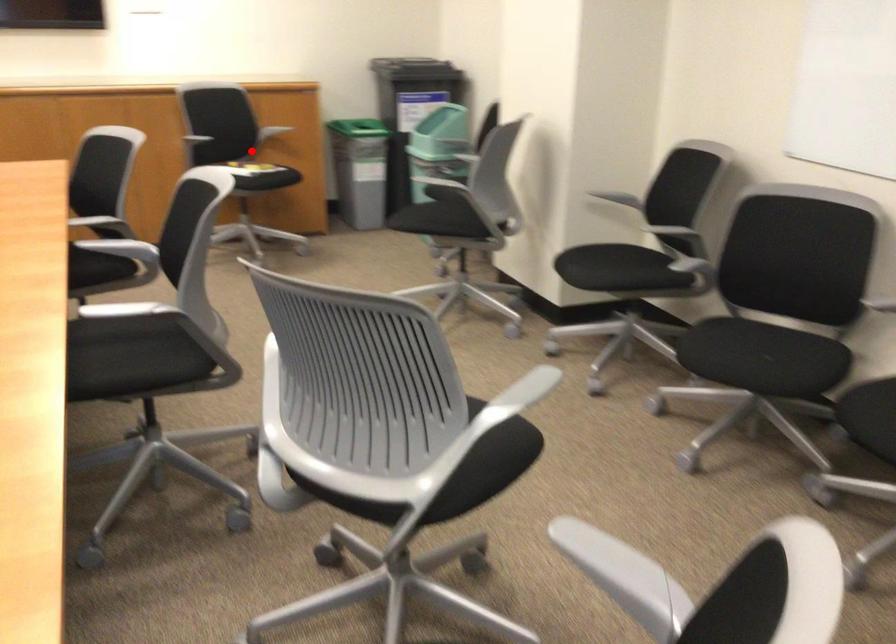
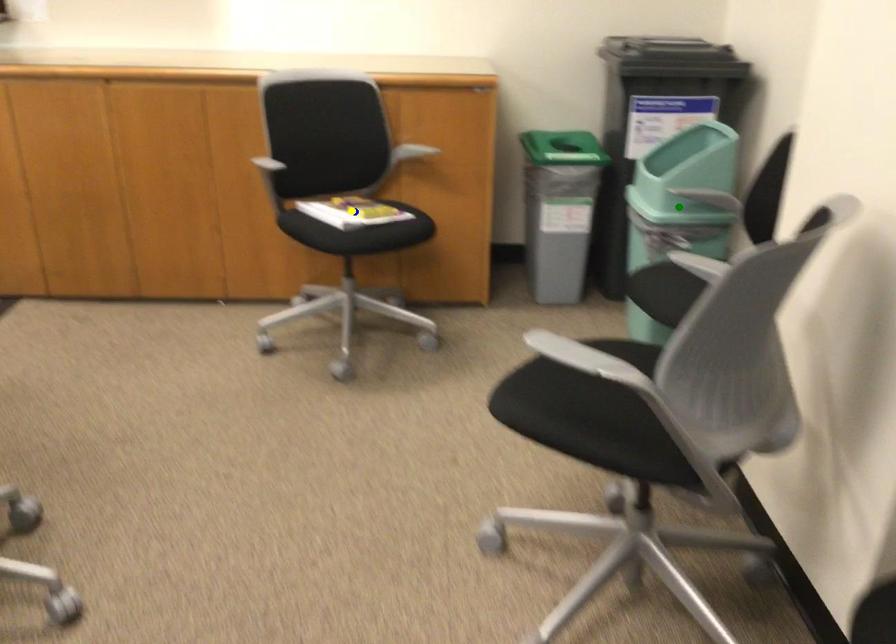
Question: I am providing you with two images of the same scene from different viewpoints. A red point is marked on the first image. You are given multiple points on the second image. Which point in image 2 is actually the same real-world point as the red point in image 1?

Choices:
 (A) blue point
 (B) yellow point
 (C) green point

Answer: (B)